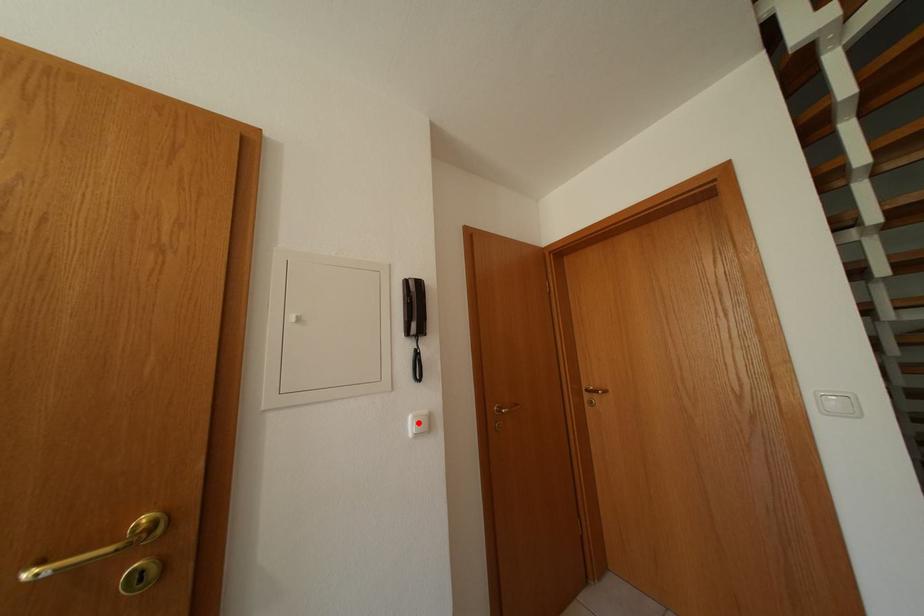
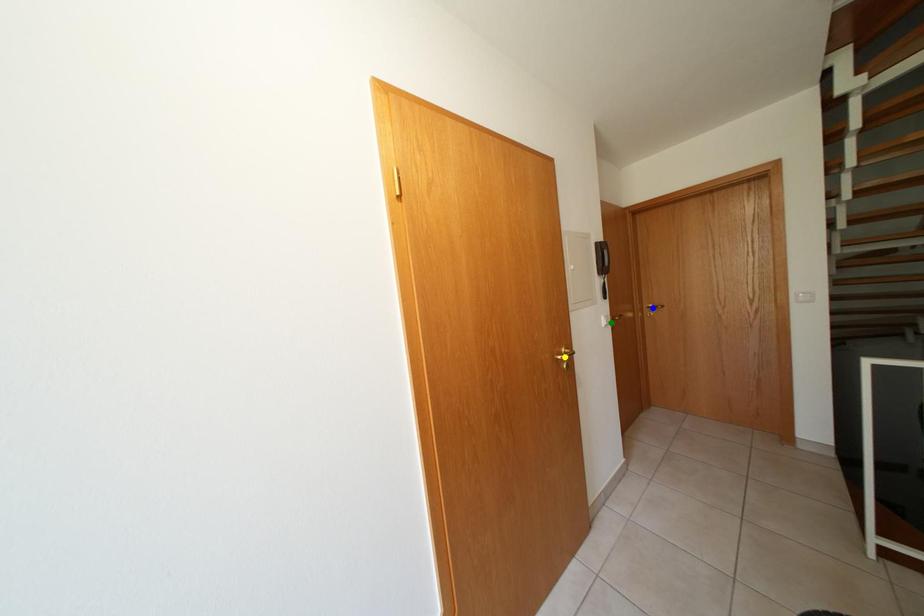
Question: I am providing you with two images of the same scene from different viewpoints. A red point is marked on the first image. You are given multiple points on the second image. Which mark in image 2 goes with the point in image 1?

Choices:
 (A) blue point
 (B) green point
 (C) yellow point

Answer: (B)